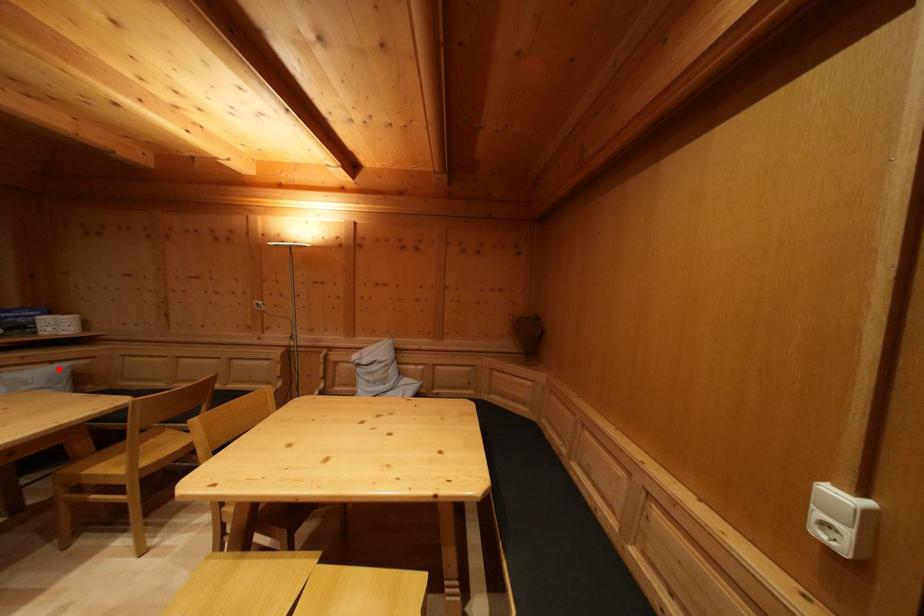
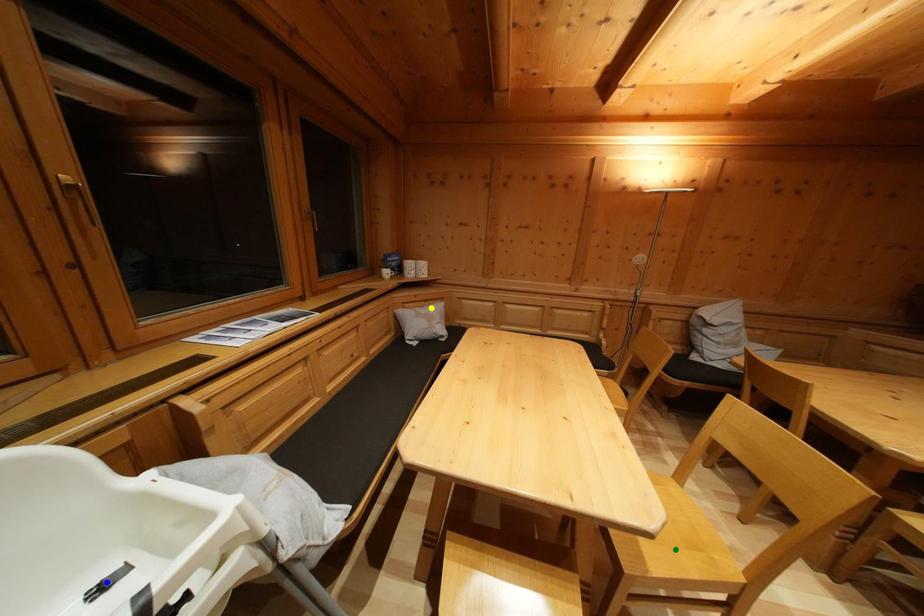
Question: I am providing you with two images of the same scene from different viewpoints. A red point is marked on the first image. You are given multiple points on the second image. Which point in image 2 represents the same 3d spot as the red point in image 1?

Choices:
 (A) yellow point
 (B) blue point
 (C) green point

Answer: (A)